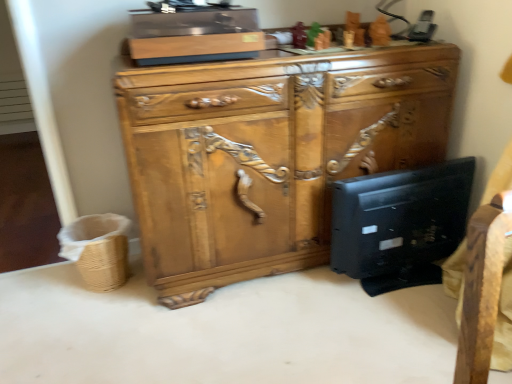
At what (x,y) coordinates should I click in order to perform the action: click on woven brown basket at lower left. Please return your answer as a coordinate pair (x, y). This screenshot has width=512, height=384. Looking at the image, I should click on (98, 249).

What do you see at coordinates (98, 249) in the screenshot? I see `woven brown basket at lower left` at bounding box center [98, 249].

Image resolution: width=512 pixels, height=384 pixels. Describe the element at coordinates (269, 154) in the screenshot. I see `wooden carved cabinet at center` at that location.

The height and width of the screenshot is (384, 512). I want to click on woven brown basket at lower left, so click(x=98, y=249).

Is black matte desktop computer at lower right behind wooden carved cabinet at center?

Yes, black matte desktop computer at lower right is further from the camera.

Considering the points (434, 192) and (267, 209), which point is behind, point (434, 192) or point (267, 209)?

Positioned behind is point (434, 192).

Could you tell me if black matte desktop computer at lower right is facing wooden carved cabinet at center?

No, black matte desktop computer at lower right is not aimed at wooden carved cabinet at center.

Does black matte desktop computer at lower right have a greater width compared to wooden carved cabinet at center?

In fact, black matte desktop computer at lower right might be narrower than wooden carved cabinet at center.

Does point (174, 235) appear closer or farther from the camera than point (108, 266)?

Point (174, 235) is positioned closer to the camera compared to point (108, 266).

Is wooden carved cabinet at center shorter than woven brown basket at lower left?

Incorrect, the height of wooden carved cabinet at center does not fall short of that of woven brown basket at lower left.

Considering the relative sizes of wooden carved cabinet at center and woven brown basket at lower left in the image provided, is wooden carved cabinet at center smaller than woven brown basket at lower left?

No, wooden carved cabinet at center is not smaller than woven brown basket at lower left.

From the image's perspective, which one is positioned higher, wooden carved cabinet at center or woven brown basket at lower left?

wooden carved cabinet at center.

Considering the sizes of wooden carved cabinet at center and black matte desktop computer at lower right in the image, is wooden carved cabinet at center wider or thinner than black matte desktop computer at lower right?

wooden carved cabinet at center is wider than black matte desktop computer at lower right.

Where is `chest of drawers in front of the black matte desktop computer at lower right`? This screenshot has width=512, height=384. chest of drawers in front of the black matte desktop computer at lower right is located at coordinates (269, 154).

Which object is further away from the camera, wooden carved cabinet at center or black matte desktop computer at lower right?

Positioned behind is black matte desktop computer at lower right.

Does wooden carved cabinet at center have a greater height compared to black matte desktop computer at lower right?

Yes, wooden carved cabinet at center is taller than black matte desktop computer at lower right.

Considering the sizes of objects woven brown basket at lower left and black matte desktop computer at lower right in the image provided, who is bigger, woven brown basket at lower left or black matte desktop computer at lower right?

Bigger between the two is black matte desktop computer at lower right.

Where is `desktop computer in front of the woven brown basket at lower left`? The height and width of the screenshot is (384, 512). desktop computer in front of the woven brown basket at lower left is located at coordinates (400, 224).

From a real-world perspective, between woven brown basket at lower left and black matte desktop computer at lower right, who is vertically higher?

black matte desktop computer at lower right is physically above.

Is woven brown basket at lower left oriented towards black matte desktop computer at lower right?

No.

Is black matte desktop computer at lower right bigger or smaller than woven brown basket at lower left?

Clearly, black matte desktop computer at lower right is larger in size than woven brown basket at lower left.

From the image's perspective, does black matte desktop computer at lower right appear lower than woven brown basket at lower left?

Actually, black matte desktop computer at lower right appears above woven brown basket at lower left in the image.

How much distance is there between black matte desktop computer at lower right and woven brown basket at lower left?

A distance of 3.70 feet exists between black matte desktop computer at lower right and woven brown basket at lower left.

Is black matte desktop computer at lower right further to camera compared to woven brown basket at lower left?

No, black matte desktop computer at lower right is closer to the camera.

From the image's perspective, relative to wooden carved cabinet at center, is woven brown basket at lower left above or below?

woven brown basket at lower left is situated lower than wooden carved cabinet at center in the image.

Is woven brown basket at lower left next to wooden carved cabinet at center and touching it?

No, woven brown basket at lower left is not with wooden carved cabinet at center.

Is woven brown basket at lower left in front of or behind wooden carved cabinet at center in the image?

Clearly, woven brown basket at lower left is behind wooden carved cabinet at center.

Considering the sizes of woven brown basket at lower left and wooden carved cabinet at center in the image, is woven brown basket at lower left wider or thinner than wooden carved cabinet at center?

In the image, woven brown basket at lower left appears to be more narrow than wooden carved cabinet at center.

Where is `the chest of drawers that is in front of the black matte desktop computer at lower right`? the chest of drawers that is in front of the black matte desktop computer at lower right is located at coordinates (269, 154).

Identify the location of basket that appears on the left of wooden carved cabinet at center. (98, 249).

Estimate the real-world distances between objects in this image. Which object is further from black matte desktop computer at lower right, woven brown basket at lower left or wooden carved cabinet at center?

woven brown basket at lower left.

When comparing their distances from black matte desktop computer at lower right, does wooden carved cabinet at center or woven brown basket at lower left seem closer?

wooden carved cabinet at center lies closer to black matte desktop computer at lower right than the other object.

From the image, which object appears to be farther from woven brown basket at lower left, wooden carved cabinet at center or black matte desktop computer at lower right?

Based on the image, black matte desktop computer at lower right appears to be further to woven brown basket at lower left.

Looking at this image, estimate the real-world distances between objects in this image. Which object is further from wooden carved cabinet at center, black matte desktop computer at lower right or woven brown basket at lower left?

woven brown basket at lower left.

Which object lies further to the anchor point wooden carved cabinet at center, woven brown basket at lower left or black matte desktop computer at lower right?

Among the two, woven brown basket at lower left is located further to wooden carved cabinet at center.

From the image, which object appears to be nearer to woven brown basket at lower left, black matte desktop computer at lower right or wooden carved cabinet at center?

Among the two, wooden carved cabinet at center is located nearer to woven brown basket at lower left.

What are the coordinates of `chest of drawers between woven brown basket at lower left and black matte desktop computer at lower right from left to right` in the screenshot? It's located at (269, 154).